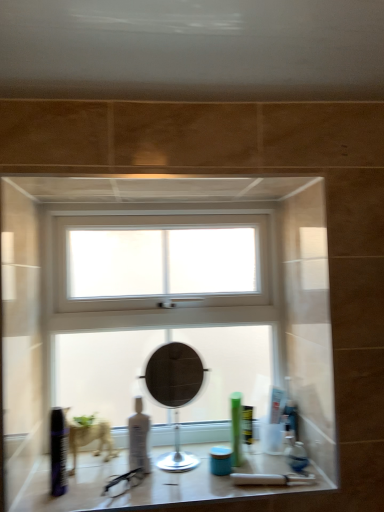
Identify the location of shiny black can at lower left, positioned as the first toiletry in left-to-right order. The width and height of the screenshot is (384, 512). (58, 451).

Where is `matte glass counter top at center`? This screenshot has width=384, height=512. matte glass counter top at center is located at coordinates (139, 484).

The width and height of the screenshot is (384, 512). Find the location of `transparent plastic bottle at center, the 2th toiletry positioned from the left`. transparent plastic bottle at center, the 2th toiletry positioned from the left is located at coordinates (139, 439).

In order to click on shiny black can at lower left, positioned as the first toiletry in left-to-right order in this screenshot , I will do `click(58, 451)`.

Would you consider matte glass counter top at center to be distant from blue matte jar at center, the third toiletry from the left?

No, there isn't a large distance between matte glass counter top at center and blue matte jar at center, the third toiletry from the left.

At what (x,y) coordinates should I click in order to perform the action: click on the 2nd toiletry behind the matte glass counter top at center, starting your count from the anchor. Please return your answer as a coordinate pair (x, y). Image resolution: width=384 pixels, height=512 pixels. Looking at the image, I should click on (220, 461).

Between point (106, 481) and point (226, 448), which one is positioned in front?

The point (106, 481) is more forward.

Could you tell me if matte glass counter top at center is facing blue matte jar at center, which is the second toiletry from right to left?

No, matte glass counter top at center is not turned towards blue matte jar at center, which is the second toiletry from right to left.

Is shiny black can at lower left, positioned as the first toiletry in left-to-right order, taller or shorter than matte glass counter top at center?

Clearly, shiny black can at lower left, positioned as the first toiletry in left-to-right order, is taller compared to matte glass counter top at center.

Does shiny black can at lower left, marked as the 4th toiletry in a right-to-left arrangement, contain matte glass counter top at center?

Definitely not — matte glass counter top at center is not inside shiny black can at lower left, marked as the 4th toiletry in a right-to-left arrangement.

Between shiny black can at lower left, positioned as the first toiletry in left-to-right order, and matte glass counter top at center, which one appears on the right side from the viewer's perspective?

matte glass counter top at center.

From a real-world perspective, is shiny black can at lower left, positioned as the first toiletry in left-to-right order, above or below matte glass counter top at center?

Clearly, from a real-world perspective, shiny black can at lower left, positioned as the first toiletry in left-to-right order, is above matte glass counter top at center.

Does clear glass window at center touch shiny black can at lower left, positioned as the first toiletry in left-to-right order?

clear glass window at center is not next to shiny black can at lower left, positioned as the first toiletry in left-to-right order, and they're not touching.

From a real-world perspective, is clear glass window at center physically located above or below shiny black can at lower left, positioned as the first toiletry in left-to-right order?

In terms of real-world spatial position, clear glass window at center is above shiny black can at lower left, positioned as the first toiletry in left-to-right order.

Which object is closer to the camera taking this photo, clear glass window at center or shiny black can at lower left, marked as the 4th toiletry in a right-to-left arrangement?

shiny black can at lower left, marked as the 4th toiletry in a right-to-left arrangement.

From the image's perspective, which object appears higher, clear glass window at center or shiny black can at lower left, positioned as the first toiletry in left-to-right order?

clear glass window at center.

Is green matte tube at center, the fourth toiletry in the left-to-right sequence, oriented away from clear glass window at center?

Yes, green matte tube at center, the fourth toiletry in the left-to-right sequence, is positioned with its back facing clear glass window at center.

The width and height of the screenshot is (384, 512). Identify the location of window on the left of green matte tube at center, the fourth toiletry in the left-to-right sequence. coord(162,328).

Looking at this image, from the image's perspective, relative to clear glass window at center, is green matte tube at center, the first toiletry when ordered from right to left, above or below?

green matte tube at center, the first toiletry when ordered from right to left, is below clear glass window at center.

Is clear glass window at center aimed at matte glass counter top at center?

Yes, clear glass window at center is aimed at matte glass counter top at center.

From a real-world perspective, is clear glass window at center physically above matte glass counter top at center?

Correct, in the physical world, clear glass window at center is higher than matte glass counter top at center.

Considering the relative positions of clear glass window at center and matte glass counter top at center in the image provided, is clear glass window at center to the left of matte glass counter top at center from the viewer's perspective?

Indeed, clear glass window at center is positioned on the left side of matte glass counter top at center.

Which of these two, clear glass window at center or matte glass counter top at center, is thinner?

Thinner between the two is clear glass window at center.

Looking at this image, considering the sizes of matte glass counter top at center and clear glass window at center in the image, is matte glass counter top at center wider or thinner than clear glass window at center?

In the image, matte glass counter top at center appears to be wider than clear glass window at center.

In the scene shown: Is matte glass counter top at center positioned beyond the bounds of clear glass window at center?

matte glass counter top at center is positioned outside clear glass window at center.

Which is more to the left, matte glass counter top at center or clear glass window at center?

clear glass window at center is more to the left.

Is blue matte jar at center, which is the second toiletry from right to left, at the left side of green matte tube at center, the first toiletry when ordered from right to left?

Yes, blue matte jar at center, which is the second toiletry from right to left, is to the left of green matte tube at center, the first toiletry when ordered from right to left.

Would you consider blue matte jar at center, which is the second toiletry from right to left, to be distant from green matte tube at center, the first toiletry when ordered from right to left?

No.

From a real-world perspective, which object stands above the other?

In real-world perspective, green matte tube at center, the fourth toiletry in the left-to-right sequence, is above.

Considering the sizes of objects blue matte jar at center, which is the second toiletry from right to left, and green matte tube at center, the first toiletry when ordered from right to left, in the image provided, who is thinner, blue matte jar at center, which is the second toiletry from right to left, or green matte tube at center, the first toiletry when ordered from right to left,?

green matte tube at center, the first toiletry when ordered from right to left.

You are a GUI agent. You are given a task and a screenshot of the screen. Output one action in this format:
    pyautogui.click(x=<x>, y=<y>)
    Task: Click on the counter top that appears on the left of blue matte jar at center, the third toiletry from the left
    
    Given the screenshot: What is the action you would take?
    pyautogui.click(x=139, y=484)

From the image's perspective, starting from the matte glass counter top at center, which toiletry is the 4th one above? Please provide its 2D coordinates.

[(58, 451)]

Which object lies nearer to the anchor point clear glass window at center, matte glass counter top at center or matte black mirror at center?

matte black mirror at center.

Estimate the real-world distances between objects in this image. Which object is closer to transparent plastic bottle at center, the 2th toiletry positioned from the left, green matte tube at center, the first toiletry when ordered from right to left, or shiny black can at lower left, positioned as the first toiletry in left-to-right order?

Based on the image, shiny black can at lower left, positioned as the first toiletry in left-to-right order, appears to be nearer to transparent plastic bottle at center, the 2th toiletry positioned from the left.

Which object lies nearer to the anchor point matte glass counter top at center, shiny black can at lower left, marked as the 4th toiletry in a right-to-left arrangement, or transparent plastic bottle at center, which is the third toiletry from right to left?

transparent plastic bottle at center, which is the third toiletry from right to left.

Which object lies nearer to the anchor point shiny black can at lower left, positioned as the first toiletry in left-to-right order, matte glass counter top at center or blue matte jar at center, the third toiletry from the left?

matte glass counter top at center is positioned closer to the anchor shiny black can at lower left, positioned as the first toiletry in left-to-right order.

Looking at the image, which one is located closer to green matte tube at center, the first toiletry when ordered from right to left, matte glass counter top at center or matte black mirror at center?

Among the two, matte black mirror at center is located nearer to green matte tube at center, the first toiletry when ordered from right to left.

Which object lies nearer to the anchor point transparent plastic bottle at center, which is the third toiletry from right to left, matte glass counter top at center or matte black mirror at center?

matte black mirror at center is closer to transparent plastic bottle at center, which is the third toiletry from right to left.

Estimate the real-world distances between objects in this image. Which object is further from matte black mirror at center, matte glass counter top at center or blue matte jar at center, which is the second toiletry from right to left?

blue matte jar at center, which is the second toiletry from right to left.

Considering their positions, is blue matte jar at center, which is the second toiletry from right to left, positioned closer to transparent plastic bottle at center, which is the third toiletry from right to left, than matte black mirror at center?

Based on the image, matte black mirror at center appears to be nearer to transparent plastic bottle at center, which is the third toiletry from right to left.

Locate an element on the screen. This screenshot has width=384, height=512. toiletry between shiny black can at lower left, marked as the 4th toiletry in a right-to-left arrangement, and matte black mirror at center is located at coordinates (139, 439).

Image resolution: width=384 pixels, height=512 pixels. I want to click on mirror between clear glass window at center and matte glass counter top at center in the vertical direction, so click(175, 393).

Where is `mirror between shiny black can at lower left, marked as the 4th toiletry in a right-to-left arrangement, and green matte tube at center, the fourth toiletry in the left-to-right sequence, from left to right`? mirror between shiny black can at lower left, marked as the 4th toiletry in a right-to-left arrangement, and green matte tube at center, the fourth toiletry in the left-to-right sequence, from left to right is located at coordinates (175, 393).

You are a GUI agent. You are given a task and a screenshot of the screen. Output one action in this format:
    pyautogui.click(x=<x>, y=<y>)
    Task: Click on the mirror situated between shiny black can at lower left, positioned as the first toiletry in left-to-right order, and blue matte jar at center, which is the second toiletry from right to left, from left to right
    Image resolution: width=384 pixels, height=512 pixels.
    Given the screenshot: What is the action you would take?
    pyautogui.click(x=175, y=393)